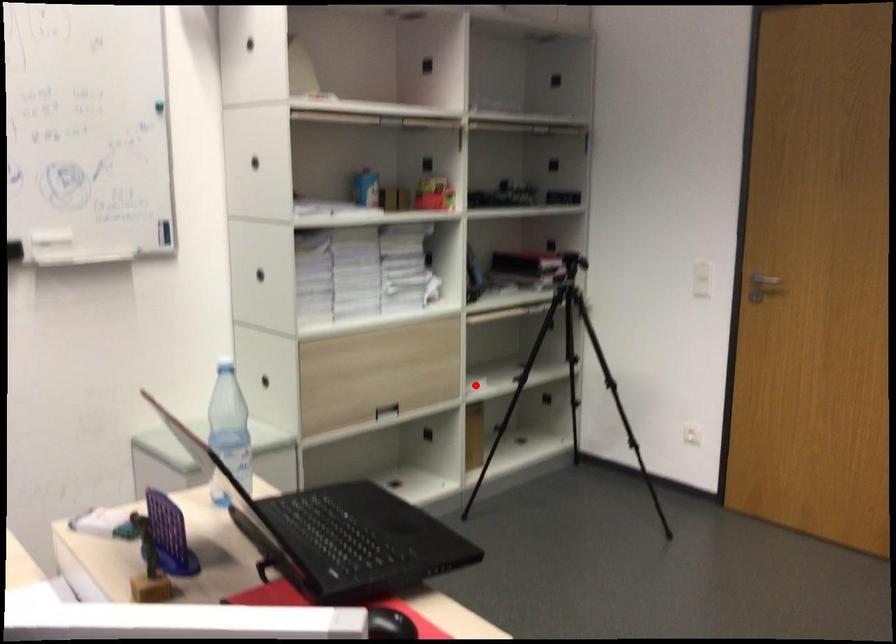
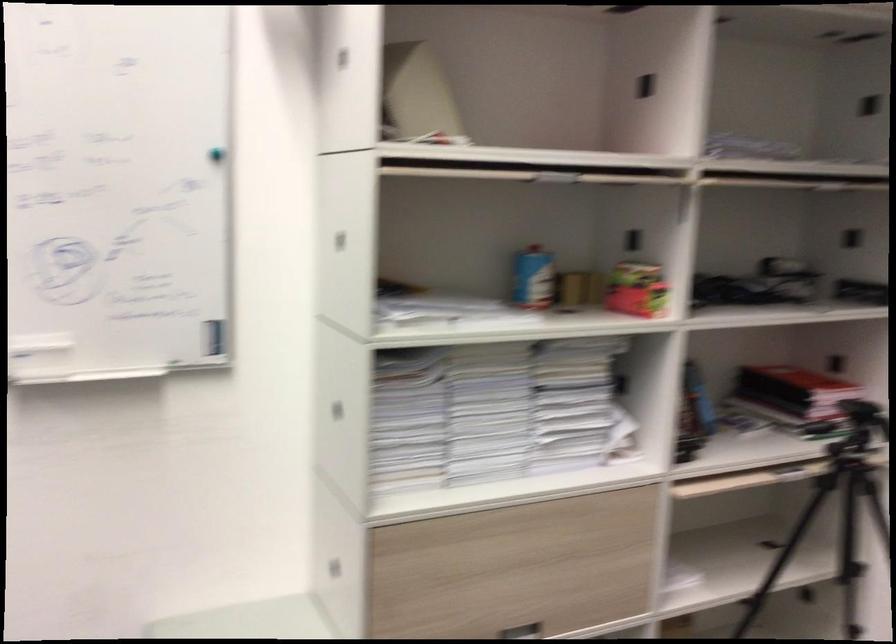
Question: I am providing you with two images of the same scene from different viewpoints. Image1 has a red point marked. In image2, the corresponding 3D location appears at what relative position? Reply with the corresponding letter.

Choices:
 (A) Closer
 (B) Farther

Answer: (A)